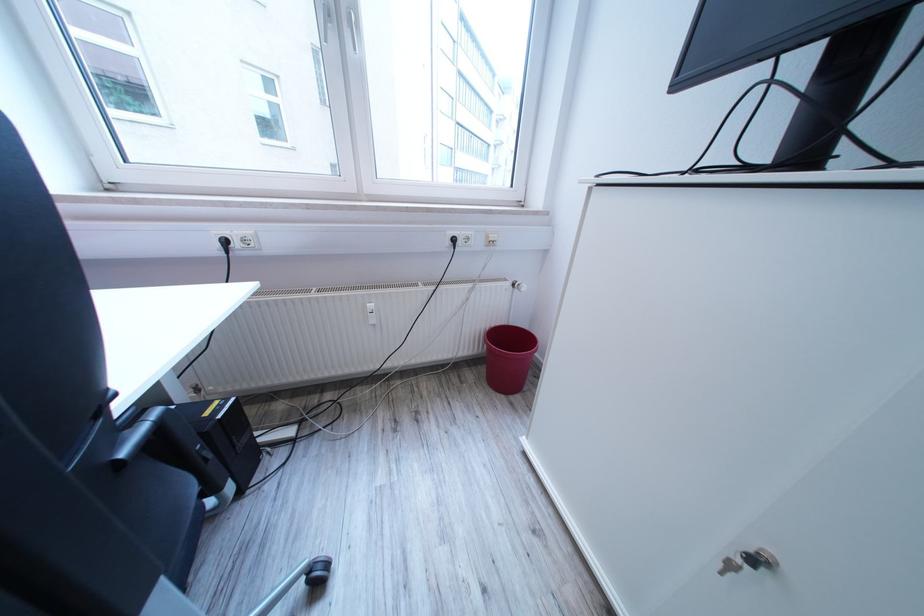
Where would you turn the white radiator valve? Please return your answer as a coordinate pair (x, y).

(346, 333)